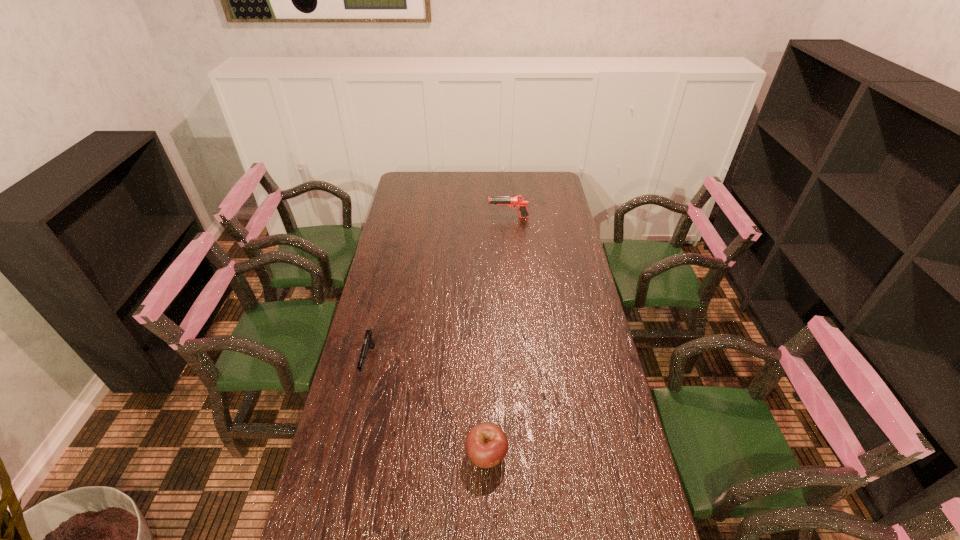
This screenshot has width=960, height=540. I want to click on object that is at the left edge, so click(x=368, y=340).

Identify the location of vacant space at the left edge of the desktop. (406, 237).

In the image, there is a desktop. At what (x,y) coordinates should I click in order to perform the action: click on free region at the right edge. Please return your answer as a coordinate pair (x, y). Image resolution: width=960 pixels, height=540 pixels. Looking at the image, I should click on (537, 213).

Where is `vacant space at the far right corner of the desktop`? This screenshot has width=960, height=540. vacant space at the far right corner of the desktop is located at coordinates (537, 180).

Identify the location of free spot between the shorter gun and the tallest object. The image size is (960, 540). coord(439,289).

Identify the location of free space between the shorter gun and the apple. This screenshot has width=960, height=540. [428, 408].

Identify the location of empty space that is in between the apple and the left gun. (428, 408).

Identify the location of free space between the nearest object and the left gun. (428, 408).

This screenshot has height=540, width=960. I want to click on vacant space that's between the apple and the left gun, so [x=428, y=408].

Locate an element on the screen. The width and height of the screenshot is (960, 540). blank region between the nearest object and the tallest object is located at coordinates (497, 336).